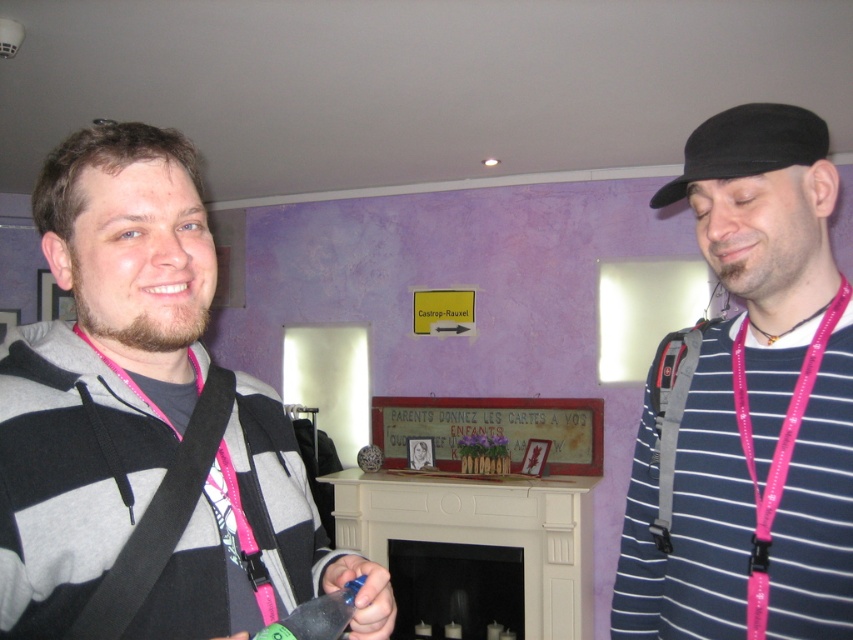
Does pink lanyard at center have a lesser height compared to pink glossy lanyard at right?

Indeed, pink lanyard at center has a lesser height compared to pink glossy lanyard at right.

Based on the photo, which is above, pink lanyard at center or pink glossy lanyard at right?

pink lanyard at center

Does point (827, 260) come in front of point (811, 355)?

No, it is not.

Where is `pink lanyard at center`? This screenshot has width=853, height=640. pink lanyard at center is located at coordinates (785, 269).

Where is `gray hoodie at center`? gray hoodie at center is located at coordinates [148, 428].

Can you confirm if gray hoodie at center is positioned to the left of striped cotton shirt at right?

Correct, you'll find gray hoodie at center to the left of striped cotton shirt at right.

At what (x,y) coordinates should I click in order to perform the action: click on gray hoodie at center. Please return your answer as a coordinate pair (x, y). This screenshot has width=853, height=640. Looking at the image, I should click on (148, 428).

Who is taller, black fabric strap at left or pink glossy lanyard at right?

Standing taller between the two is pink glossy lanyard at right.

Is point (165, 560) farther from camera compared to point (775, 502)?

No, it is in front of (775, 502).

Between point (99, 634) and point (759, 496), which one is positioned behind?

Point (759, 496)

Find the location of a particular element. black fabric strap at left is located at coordinates (160, 516).